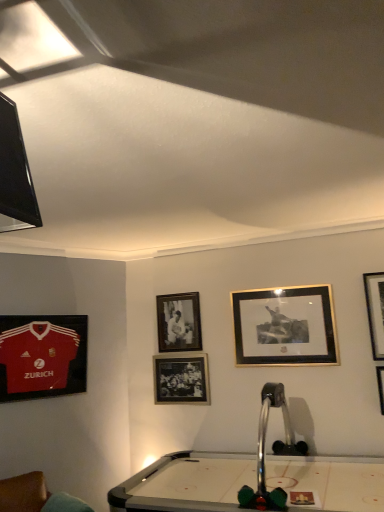
Question: Is gold/black picture frame at upper center, the second picture frame viewed from the right, to the left of metallic silver billiard table at center from the viewer's perspective?

Choices:
 (A) yes
 (B) no

Answer: (B)

Question: From the image's perspective, is gold/black picture frame at upper center, which is the 4th picture frame from left to right, under metallic silver billiard table at center?

Choices:
 (A) no
 (B) yes

Answer: (A)

Question: Considering the relative positions of gold/black picture frame at upper center, the second picture frame viewed from the right, and metallic silver billiard table at center in the image provided, is gold/black picture frame at upper center, the second picture frame viewed from the right, to the right of metallic silver billiard table at center from the viewer's perspective?

Choices:
 (A) yes
 (B) no

Answer: (A)

Question: Does gold/black picture frame at upper center, which is the 4th picture frame from left to right, have a greater height compared to metallic silver billiard table at center?

Choices:
 (A) no
 (B) yes

Answer: (A)

Question: Is gold/black picture frame at upper center, which is the 4th picture frame from left to right, in front of metallic silver billiard table at center?

Choices:
 (A) no
 (B) yes

Answer: (A)

Question: Which is correct: metallic silver billiard table at center is inside gold-framed picture at upper right, which is counted as the first picture frame, starting from the right, or outside of it?

Choices:
 (A) outside
 (B) inside

Answer: (A)

Question: From a real-world perspective, relative to gold-framed picture at upper right, which is counted as the first picture frame, starting from the right, is metallic silver billiard table at center vertically above or below?

Choices:
 (A) below
 (B) above

Answer: (A)

Question: Considering the positions of point (354, 466) and point (377, 311), is point (354, 466) closer or farther from the camera than point (377, 311)?

Choices:
 (A) closer
 (B) farther

Answer: (A)

Question: Considering the positions of metallic silver billiard table at center and gold-framed picture at upper right, which is the 5th picture frame from left to right, in the image, is metallic silver billiard table at center taller or shorter than gold-framed picture at upper right, which is the 5th picture frame from left to right,?

Choices:
 (A) short
 (B) tall

Answer: (B)

Question: Is metallic silver billiard table at center wider or thinner than gold/black picture frame at upper center, the second picture frame viewed from the right?

Choices:
 (A) wide
 (B) thin

Answer: (A)

Question: From the image's perspective, is metallic silver billiard table at center above or below gold/black picture frame at upper center, which is the 4th picture frame from left to right?

Choices:
 (A) above
 (B) below

Answer: (B)

Question: Considering the positions of metallic silver billiard table at center and gold/black picture frame at upper center, which is the 4th picture frame from left to right, in the image, is metallic silver billiard table at center bigger or smaller than gold/black picture frame at upper center, which is the 4th picture frame from left to right,?

Choices:
 (A) small
 (B) big

Answer: (B)

Question: From their relative heights in the image, would you say metallic silver billiard table at center is taller or shorter than gold/black picture frame at upper center, which is the 4th picture frame from left to right?

Choices:
 (A) tall
 (B) short

Answer: (A)

Question: From a real-world perspective, is gold/black picture frame at upper center, which is the 4th picture frame from left to right, positioned above or below matte jersey at left, positioned as the first picture frame in left-to-right order?

Choices:
 (A) above
 (B) below

Answer: (A)

Question: Is gold/black picture frame at upper center, which is the 4th picture frame from left to right, to the left or to the right of matte jersey at left, the fifth picture frame viewed from the right, in the image?

Choices:
 (A) left
 (B) right

Answer: (B)